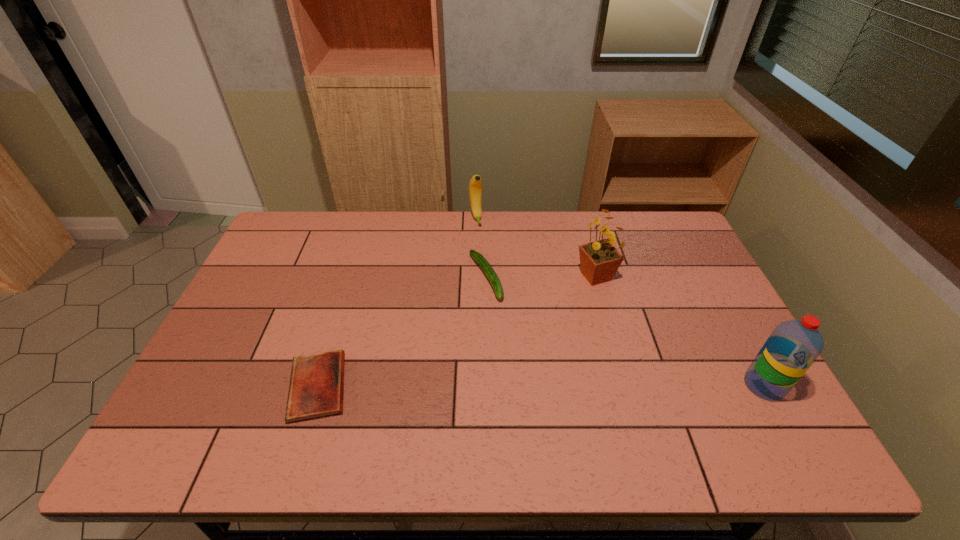
I want to click on blank area in the image that satisfies the following two spatial constraints: 1. on the back side of the zucchini; 2. on the left side of the sunflower, so click(486, 276).

The image size is (960, 540). I want to click on free region that satisfies the following two spatial constraints: 1. on the front side of the sunflower; 2. on the front label of the water bottle, so click(x=626, y=385).